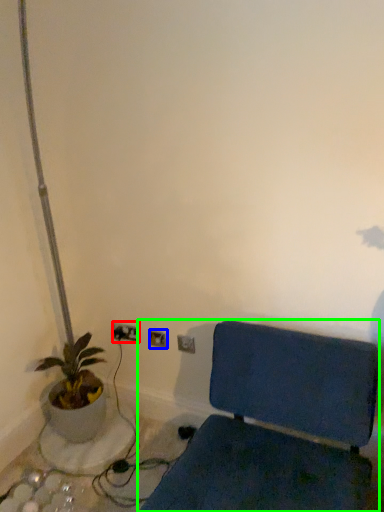
Question: Which object is the farthest from electric outlet (highlighted by a red box)? Choose among these: electric outlet (highlighted by a blue box) or furniture (highlighted by a green box).

Choices:
 (A) electric outlet
 (B) furniture

Answer: (B)